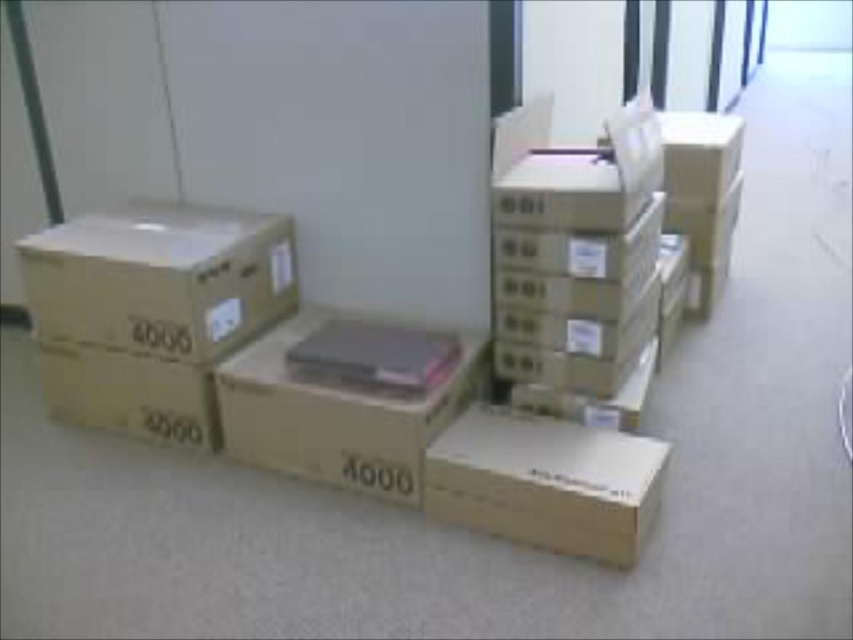
What is located at the coordinates point (160, 278) in the room?

The brown cardboard box at left is located at point (160, 278).

You are organizing boxes in a storage room and need to place a new box between the brown cardboard box at left and the brown cardboard box at center. Which side of the new box should you place it to ensure it fits between them?

Since the brown cardboard box at left is smaller than the brown cardboard box at center, you should place the new box on the side of the brown cardboard box at left to ensure it fits between them.

You are standing in the room and want to place a small package on the closest brown cardboard box. Which box should you choose between the brown cardboard box at lower center and the brown cardboard box at center?

The brown cardboard box at lower center is closer to the viewer, so you should place the small package there.